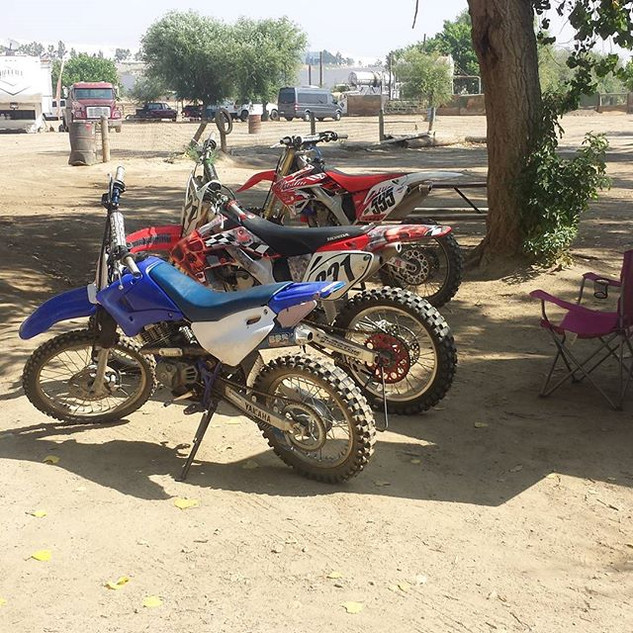
The image size is (633, 633). Identify the location of cupholder. (602, 290).